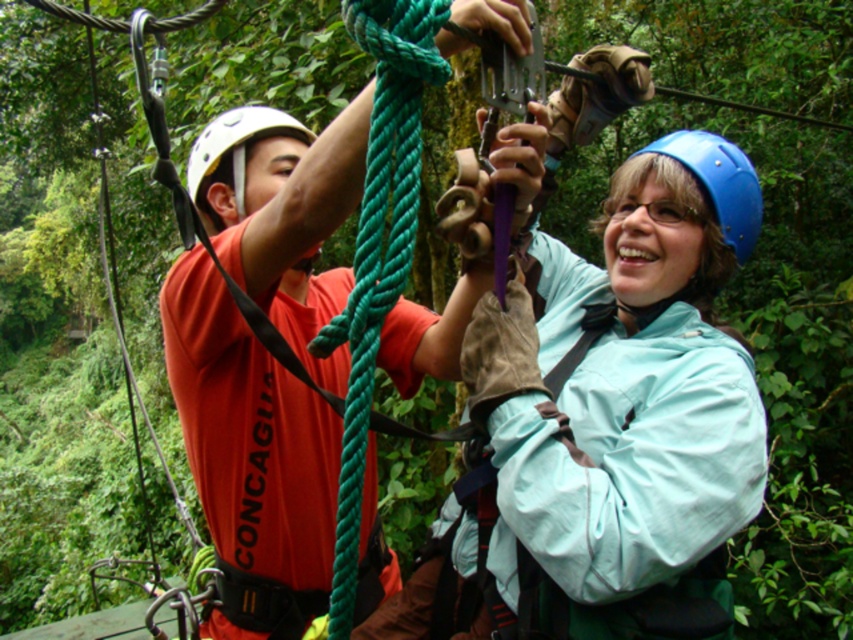
Which of these two, blue matte helmet at center or white matte helmet at upper left, stands shorter?

Standing shorter between the two is white matte helmet at upper left.

Is blue matte helmet at center thinner than white matte helmet at upper left?

Yes.

Image resolution: width=853 pixels, height=640 pixels. Describe the element at coordinates (718, 182) in the screenshot. I see `blue matte helmet at center` at that location.

This screenshot has width=853, height=640. Identify the location of blue matte helmet at center. (718, 182).